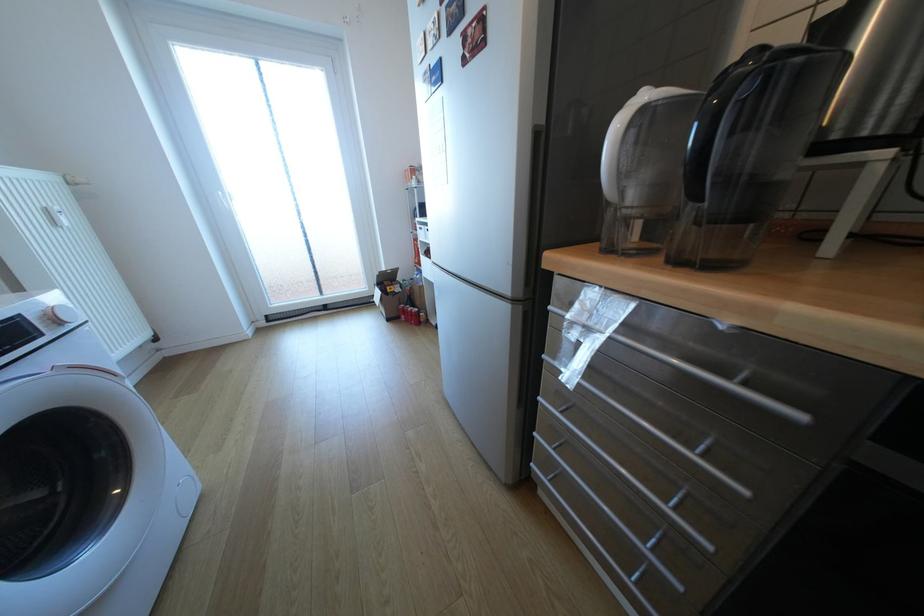
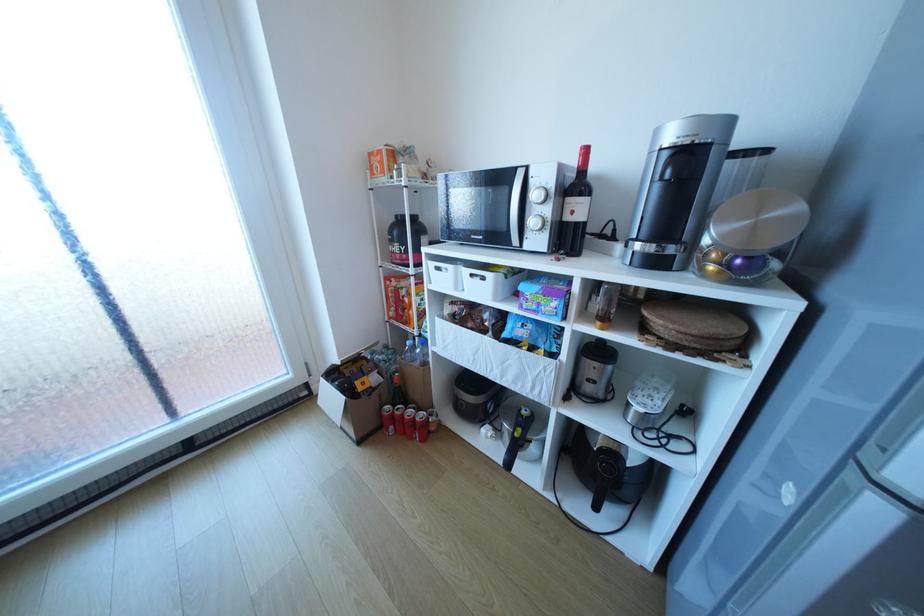
The point at [420,323] is marked in the first image. Where is the corresponding point in the second image?

(420, 438)